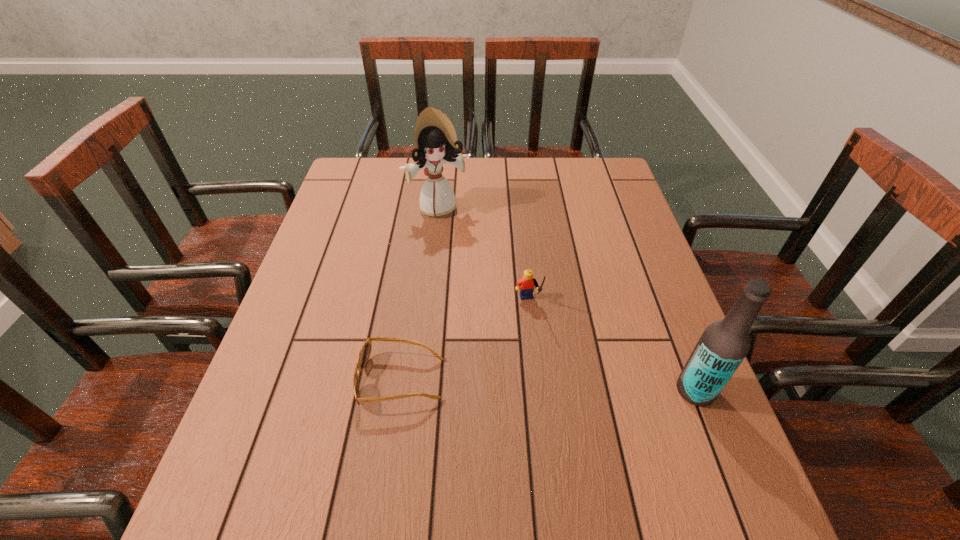
Locate an element on the screen. Image resolution: width=960 pixels, height=540 pixels. the shortest object is located at coordinates (365, 351).

This screenshot has height=540, width=960. Find the location of `the rightmost object`. the rightmost object is located at coordinates (724, 344).

Find the location of a particular element. the farthest object is located at coordinates (435, 142).

Identify the location of Lego. This screenshot has width=960, height=540. (525, 285).

At what (x,y) coordinates should I click in order to perform the action: click on the second shortest object. Please return your answer as a coordinate pair (x, y). This screenshot has height=540, width=960. Looking at the image, I should click on (525, 285).

Find the location of `vacant space located on the front-facing side of the sunglasses`. vacant space located on the front-facing side of the sunglasses is located at coordinates (322, 380).

This screenshot has width=960, height=540. What are the coordinates of `vacant region located 0.100m on the front-facing side of the sunglasses` in the screenshot? It's located at (311, 380).

Identify the location of blank space located on the front-facing side of the sunglasses. The image size is (960, 540). (317, 380).

Where is `vacant space located on the side of the beer bottle with the label`? vacant space located on the side of the beer bottle with the label is located at coordinates (573, 390).

You are a GUI agent. You are given a task and a screenshot of the screen. Output one action in this format:
    pyautogui.click(x=<x>, y=<y>)
    Task: Click on the free space located on the side of the beer bottle with the label
    This screenshot has height=540, width=960.
    Given the screenshot: What is the action you would take?
    pyautogui.click(x=564, y=390)